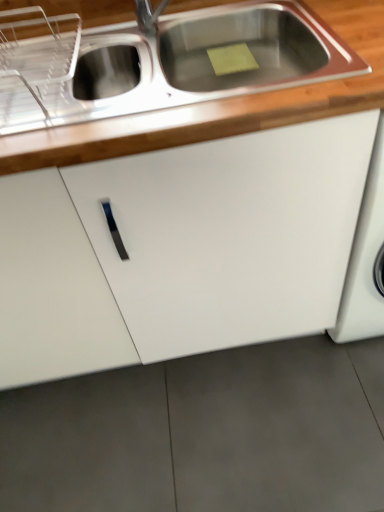
Question: Is white matte cabinet at center shorter than wooden countertop at upper center?

Choices:
 (A) no
 (B) yes

Answer: (A)

Question: Does white matte cabinet at center lie behind wooden countertop at upper center?

Choices:
 (A) yes
 (B) no

Answer: (A)

Question: Considering the relative sizes of white matte cabinet at center and wooden countertop at upper center in the image provided, is white matte cabinet at center bigger than wooden countertop at upper center?

Choices:
 (A) no
 (B) yes

Answer: (B)

Question: Could wooden countertop at upper center be considered to be inside white matte cabinet at center?

Choices:
 (A) no
 (B) yes

Answer: (B)

Question: Considering the relative sizes of white matte cabinet at center and wooden countertop at upper center in the image provided, is white matte cabinet at center thinner than wooden countertop at upper center?

Choices:
 (A) yes
 (B) no

Answer: (B)

Question: Is the position of white matte cabinet at center less distant than that of wooden countertop at upper center?

Choices:
 (A) no
 (B) yes

Answer: (A)

Question: Is wooden countertop at upper center at the left side of white matte cabinet at center?

Choices:
 (A) no
 (B) yes

Answer: (A)

Question: Can you confirm if wooden countertop at upper center is thinner than white matte cabinet at center?

Choices:
 (A) no
 (B) yes

Answer: (B)

Question: Can you confirm if wooden countertop at upper center is wider than white matte cabinet at center?

Choices:
 (A) no
 (B) yes

Answer: (A)

Question: Is wooden countertop at upper center looking in the opposite direction of white matte cabinet at center?

Choices:
 (A) yes
 (B) no

Answer: (A)

Question: Is wooden countertop at upper center at the right side of white matte cabinet at center?

Choices:
 (A) yes
 (B) no

Answer: (A)

Question: Is the surface of wooden countertop at upper center in direct contact with white matte cabinet at center?

Choices:
 (A) no
 (B) yes

Answer: (A)

Question: From the image's perspective, relative to white matte cabinet at center, is wooden countertop at upper center above or below?

Choices:
 (A) below
 (B) above

Answer: (B)